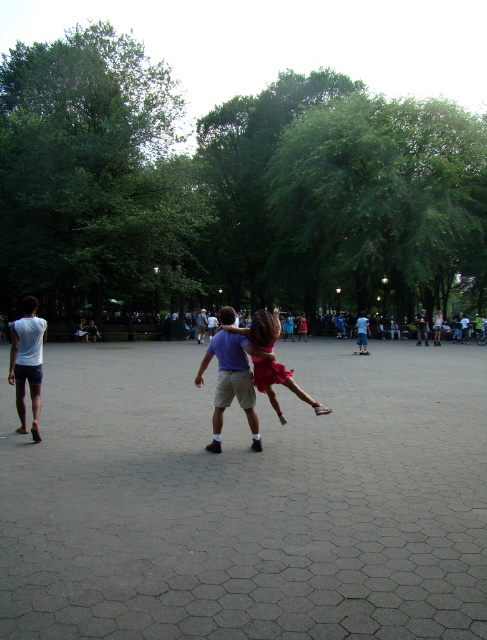
Can you confirm if white matte shorts at left is positioned to the right of matte red dress at center?

Incorrect, white matte shorts at left is not on the right side of matte red dress at center.

Can you confirm if white matte shorts at left is taller than matte red dress at center?

Yes.

You are a GUI agent. You are given a task and a screenshot of the screen. Output one action in this format:
    pyautogui.click(x=<x>, y=<y>)
    Task: Click on the white matte shorts at left
    This screenshot has height=640, width=487.
    Given the screenshot: What is the action you would take?
    pyautogui.click(x=26, y=362)

Is point (255, 433) more distant than point (23, 353)?

No.

Can you confirm if matte purple shirt at center is positioned above white matte shorts at left?

No.

What are the coordinates of `matte purple shirt at center` in the screenshot? It's located at (231, 381).

What do you see at coordinates (231, 381) in the screenshot? This screenshot has width=487, height=640. I see `matte purple shirt at center` at bounding box center [231, 381].

Can you confirm if matte purple shirt at center is positioned below matte red dress at center?

Yes, matte purple shirt at center is below matte red dress at center.

What do you see at coordinates (231, 381) in the screenshot?
I see `matte purple shirt at center` at bounding box center [231, 381].

Locate an element on the screen. matte purple shirt at center is located at coordinates (231, 381).